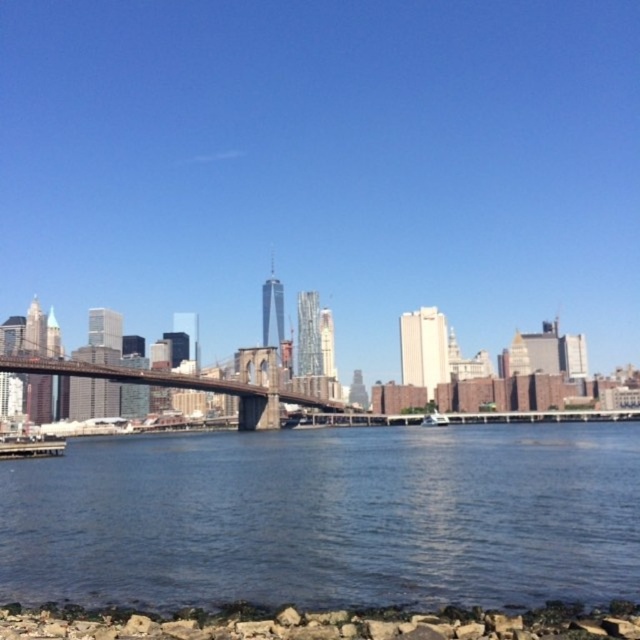
You are a photographer planning to capture the entire city skyline and the bridge in one shot. Given that your camera can only focus on objects within a 100m width, and the brown wooden bridge at center is 30m wide, will the blue water at lower center fit within the camera frame?

The blue water at lower center is bigger than the brown wooden bridge at center, which is 30m wide. Since the water is larger, it would exceed the camera frame of 100m width. Therefore, the blue water at lower center might not fit entirely within the camera frame.

Looking at this image, you are standing on the brown wooden bridge at center and want to get to the blue water at lower center. Which direction should you move to reach it?

The blue water at lower center is located below the brown wooden bridge at center, so you should move downward to reach it.